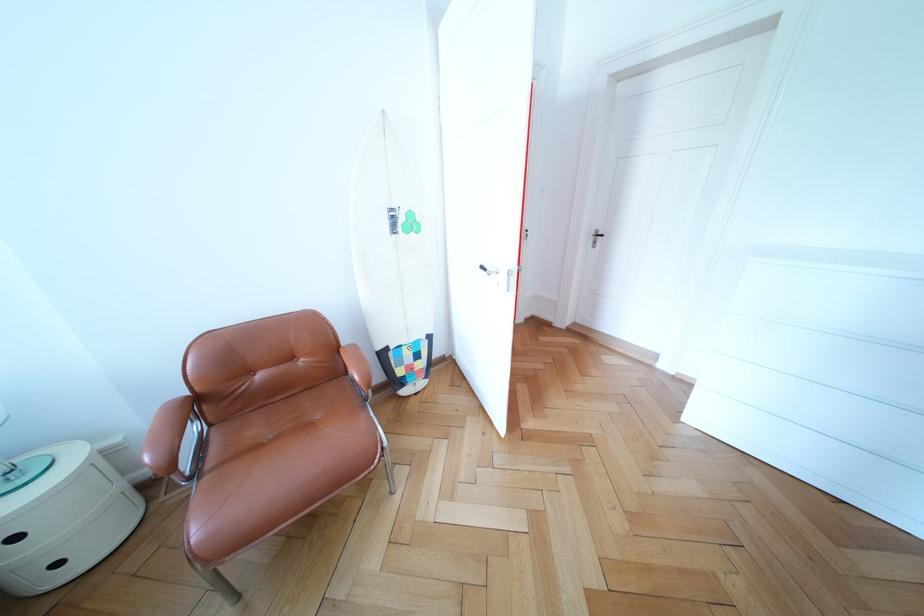
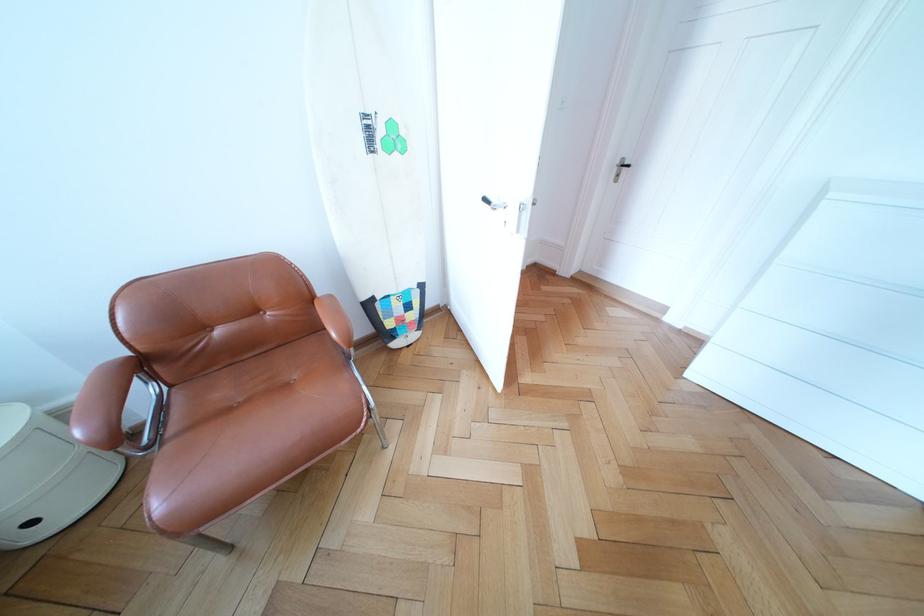
Where in the second image is the point corresponding to (x=68, y=570) from the first image?

(43, 529)